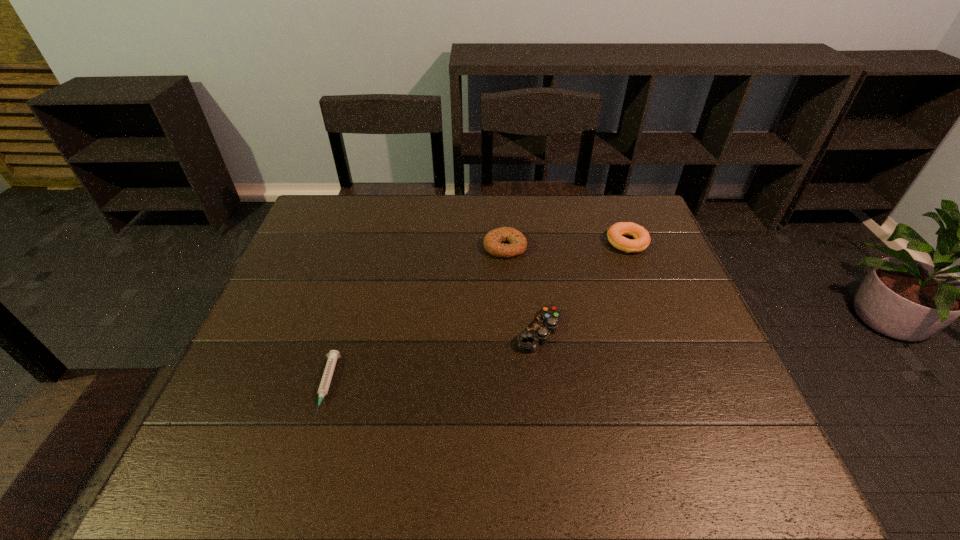
This screenshot has width=960, height=540. What are the coordinates of `empty location between the control and the left bagel` in the screenshot? It's located at (522, 289).

You are a GUI agent. You are given a task and a screenshot of the screen. Output one action in this format:
    pyautogui.click(x=<x>, y=<y>)
    Task: Click on the vacant area that lies between the third farthest object and the left bagel
    
    Given the screenshot: What is the action you would take?
    pyautogui.click(x=522, y=289)

This screenshot has width=960, height=540. What are the coordinates of `free area in between the left bagel and the rightmost object` in the screenshot? It's located at (566, 245).

At what (x,y) coordinates should I click in order to perform the action: click on free space that is in between the right bagel and the left bagel. Please return your answer as a coordinate pair (x, y). The height and width of the screenshot is (540, 960). Looking at the image, I should click on (566, 245).

What are the coordinates of `empty location between the right bagel and the shortest object` in the screenshot? It's located at pyautogui.click(x=477, y=315).

Find the location of a particular element. This screenshot has height=540, width=960. free space between the nearest object and the left bagel is located at coordinates (416, 316).

Where is `unoccupied position between the second shortest object and the nearest object`? The image size is (960, 540). unoccupied position between the second shortest object and the nearest object is located at coordinates (433, 359).

The height and width of the screenshot is (540, 960). Find the location of `empty space that is in between the left bagel and the right bagel`. empty space that is in between the left bagel and the right bagel is located at coordinates pos(566,245).

Find the location of a particular element. This screenshot has width=960, height=540. free space between the right bagel and the shortest object is located at coordinates (477, 315).

The width and height of the screenshot is (960, 540). I want to click on free spot between the leftmost object and the second shortest object, so click(x=433, y=359).